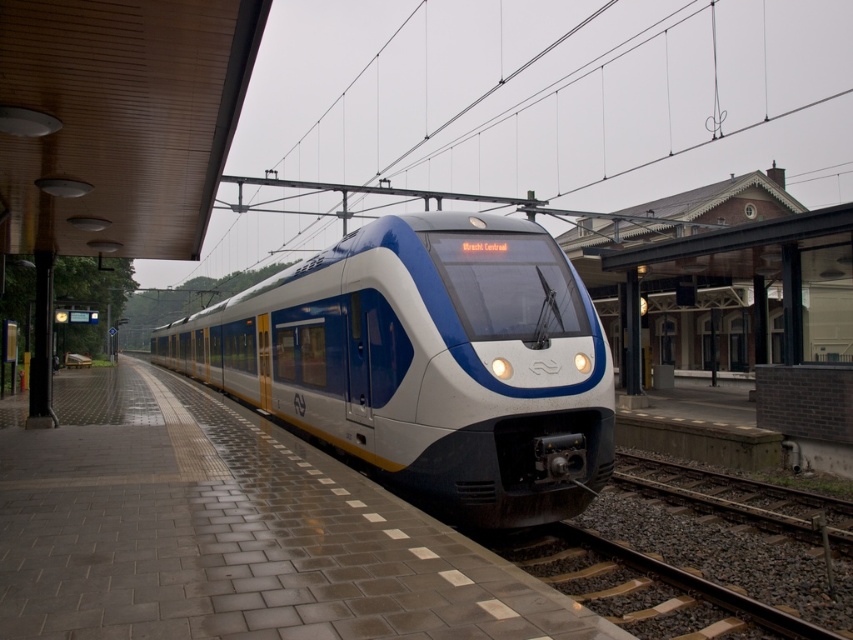
You are standing on the platform looking at the train. There are two points marked on the platform. The first point is at coordinates point (419, 627) and the second is at point (467, 412). Which point is closer to you?

Point (419, 627) is closer to the camera than point (467, 412), so the first point is closer to you.

You are standing at the edge of the platform on the modern electric train at a station. You notice a point marked at coordinates (231, 532). Based on the scene description, what object or feature does this point most likely represent?

The point at coordinates (231, 532) corresponds to the brick platform at center.

You are standing at the point marked as point (231, 476) on the platform. The train is about to depart. You need to reach the train within 10 seconds. Assuming you can run at a constant speed of 3 feet per second, will you be able to reach the train before it leaves?

The distance between point (231, 476) and the camera is 25.41 feet. Running at 3 feet per second, it would take you 25.41 divided by 3 equals approximately 8.47 seconds. Since you have 10 seconds, yes, you will be able to reach the train before it leaves.